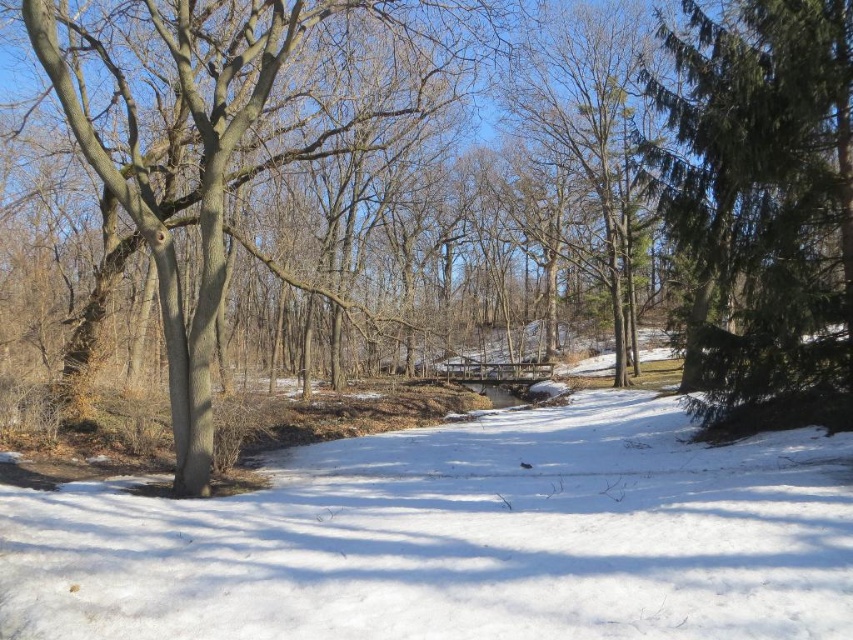
Does white powdery snow at center appear on the right side of brown bark tree at left?

Indeed, white powdery snow at center is positioned on the right side of brown bark tree at left.

Which of these two, white powdery snow at center or brown bark tree at left, stands taller?

brown bark tree at left is taller.

Where is `white powdery snow at center`? The width and height of the screenshot is (853, 640). white powdery snow at center is located at coordinates (459, 538).

Which of these two, white powdery snow at center or green needle-like tree at right, stands shorter?

Standing shorter between the two is green needle-like tree at right.

Who is more distant from viewer, [146,593] or [767,115]?

Point [767,115]

Between point (157, 621) and point (827, 124), which one is positioned in front?

Point (157, 621) is in front.

Identify the location of white powdery snow at center. (459, 538).

Does point (802, 314) come in front of point (196, 374)?

No, (802, 314) is behind (196, 374).

Can you confirm if green needle-like tree at right is taller than brown bark tree at left?

No, green needle-like tree at right is not taller than brown bark tree at left.

What do you see at coordinates (764, 204) in the screenshot? Image resolution: width=853 pixels, height=640 pixels. I see `green needle-like tree at right` at bounding box center [764, 204].

Locate an element on the screen. The height and width of the screenshot is (640, 853). green needle-like tree at right is located at coordinates (764, 204).